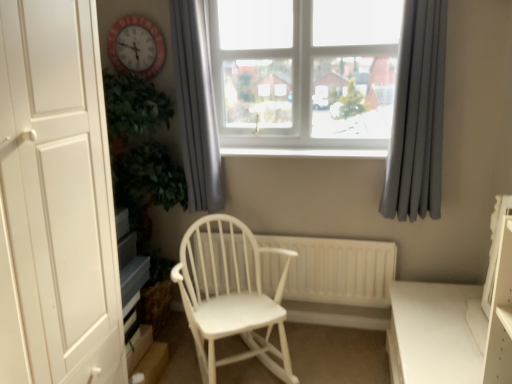
Question: From a real-world perspective, relative to white matte door at left, is white wooden radiator at center vertically above or below?

Choices:
 (A) above
 (B) below

Answer: (B)

Question: In terms of size, does white wooden radiator at center appear bigger or smaller than white matte door at left?

Choices:
 (A) small
 (B) big

Answer: (A)

Question: Which is farther from the white glossy table at lower right?

Choices:
 (A) gray fabric curtain at upper center, marked as the second curtain in a right-to-left arrangement
 (B) white wood rocking chair at center
 (C) white plastic window at upper center
 (D) red plastic clock at upper left
 (E) white wood at center

Answer: (D)

Question: Which object is positioned closest to the white glossy table at lower right?

Choices:
 (A) red plastic clock at upper left
 (B) white plastic window at upper center
 (C) white wooden radiator at center
 (D) gray fabric curtain at upper center, which appears as the first curtain when viewed from the left
 (E) white wood rocking chair at center

Answer: (C)